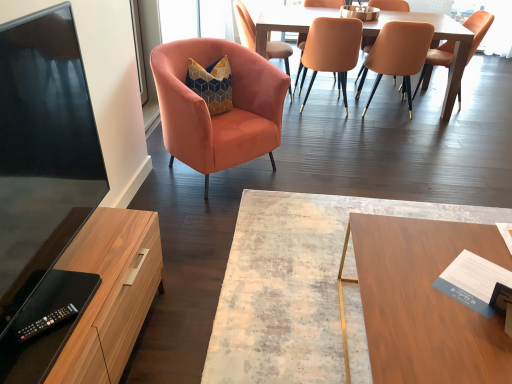
You are a GUI agent. You are given a task and a screenshot of the screen. Output one action in this format:
    pyautogui.click(x=<x>, y=<y>)
    Task: Click on the spots to the right of black plastic remote control at lower left
    The width and height of the screenshot is (512, 384).
    Given the screenshot: What is the action you would take?
    pyautogui.click(x=76, y=325)